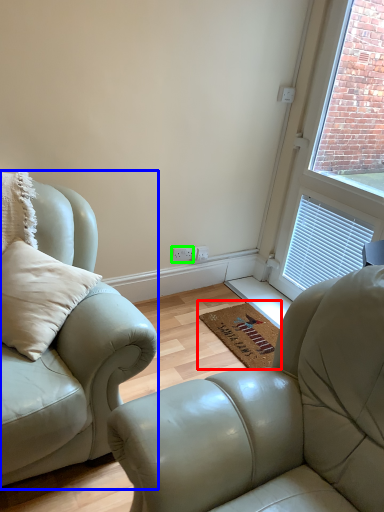
Question: Which is farther away from doormat (highlighted by a red box)? studio couch (highlighted by a blue box) or electric outlet (highlighted by a green box)?

Choices:
 (A) studio couch
 (B) electric outlet

Answer: (A)